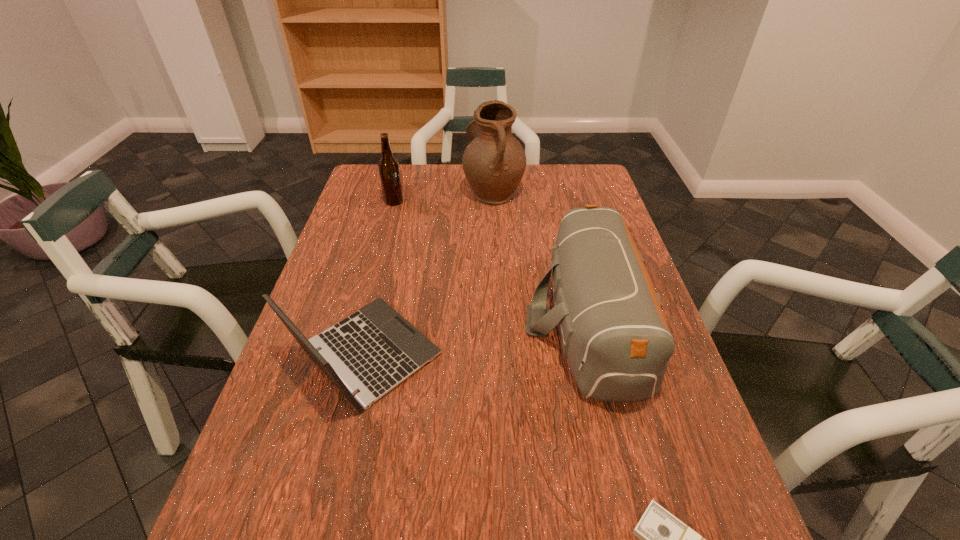
Locate which object ranks second in proximity to the beer bottle. Please provide its 2D coordinates. Your answer should be formatted as a tuple, i.e. [(x, y)], where the tuple contains the x and y coordinates of a point satisfying the conditions above.

[(373, 350)]

Find the location of a particular element. This screenshot has width=960, height=540. vacant area in the image that satisfies the following two spatial constraints: 1. on the label of the beer bottle; 2. on the left side of the duffel bag is located at coordinates (362, 321).

Locate an element on the screen. blank area in the image that satisfies the following two spatial constraints: 1. at the spout of the duffel bag; 2. on the left side of the pitcher is located at coordinates [x=499, y=321].

At what (x,y) coordinates should I click in order to perform the action: click on blank area in the image that satisfies the following two spatial constraints: 1. at the spout of the tallest object; 2. on the left side of the duffel bag. Please return your answer as a coordinate pair (x, y). The image size is (960, 540). Looking at the image, I should click on (499, 321).

This screenshot has height=540, width=960. Identify the location of free location that satisfies the following two spatial constraints: 1. on the back side of the duffel bag; 2. on the label of the beer bottle. (559, 202).